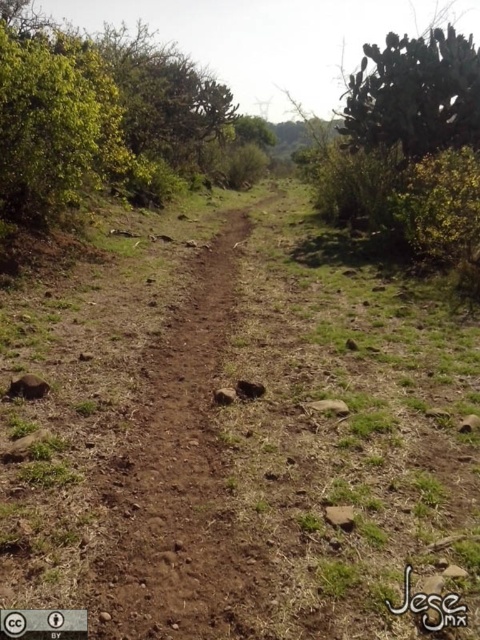
Can you confirm if brown dirt track at center is positioned to the left of green spiny cactus at upper right?

Yes, brown dirt track at center is to the left of green spiny cactus at upper right.

Can you confirm if brown dirt track at center is wider than green spiny cactus at upper right?

Incorrect, brown dirt track at center's width does not surpass green spiny cactus at upper right's.

Who is more forward, (192, 586) or (475, 109)?

Positioned in front is point (192, 586).

Identify the location of brown dirt track at center. (173, 476).

Does dirt path at center come in front of brown dirt track at center?

Yes, dirt path at center is closer to the viewer.

Based on the photo, is dirt path at center thinner than brown dirt track at center?

Incorrect, dirt path at center's width is not less than brown dirt track at center's.

Between point (360, 353) and point (135, 598), which one is positioned behind?

The point (360, 353) is behind.

Locate an element on the screen. dirt path at center is located at coordinates (240, 436).

Which is in front, point (456, 541) or point (445, 72)?

Point (456, 541) is more forward.

Who is more forward, (252, 456) or (439, 93)?

Point (252, 456)

The width and height of the screenshot is (480, 640). I want to click on dirt path at center, so click(240, 436).